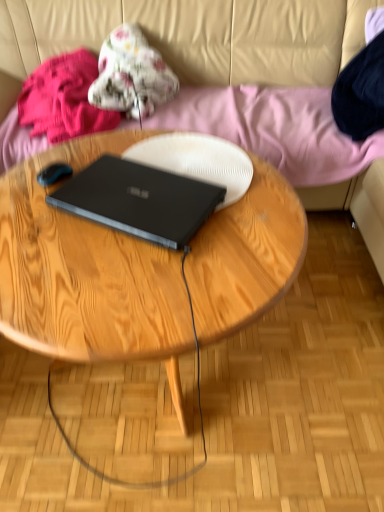
Image resolution: width=384 pixels, height=512 pixels. Identify the location of vacant area on top of black matte laptop at center (from a real-world perspective). (141, 189).